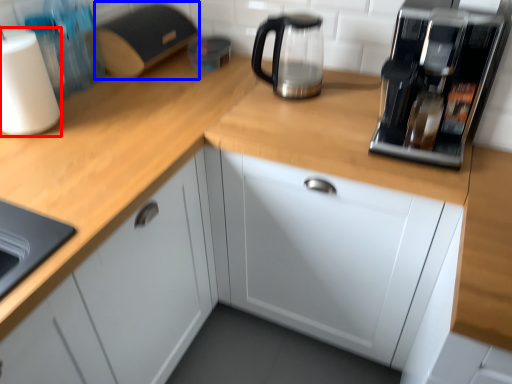
Question: Which object appears closest to the camera in this image, paper towel (highlighted by a red box) or appliance (highlighted by a blue box)?

Choices:
 (A) paper towel
 (B) appliance

Answer: (A)